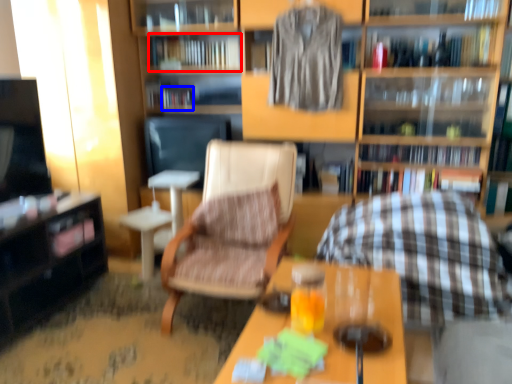
Question: Among these objects, which one is nearest to the camera, book (highlighted by a red box) or book (highlighted by a blue box)?

Choices:
 (A) book
 (B) book

Answer: (A)